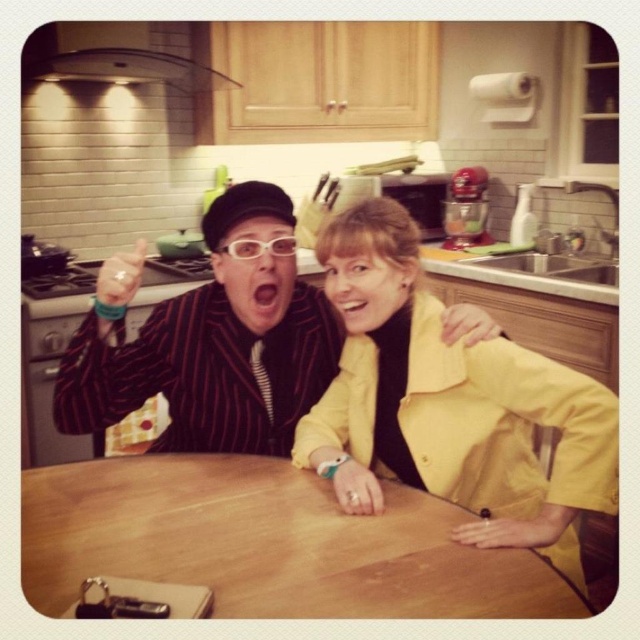
You are standing in the kitchen and see two points marked on the counter. The first point is at position point (365, 592) and the second point is at position point (113, 362). Which point is closer to you?

Point (365, 592) is in front of point (113, 362), so it is closer to you.